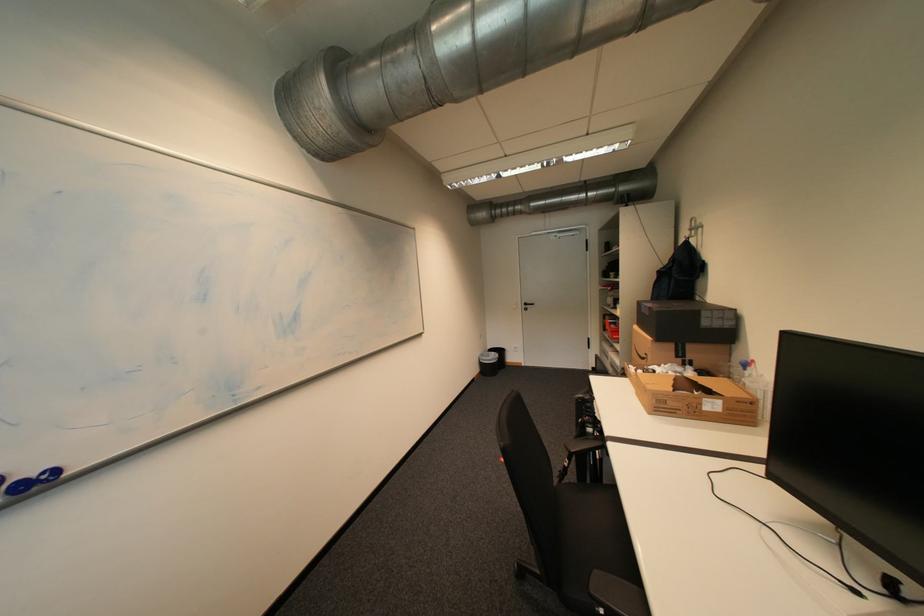
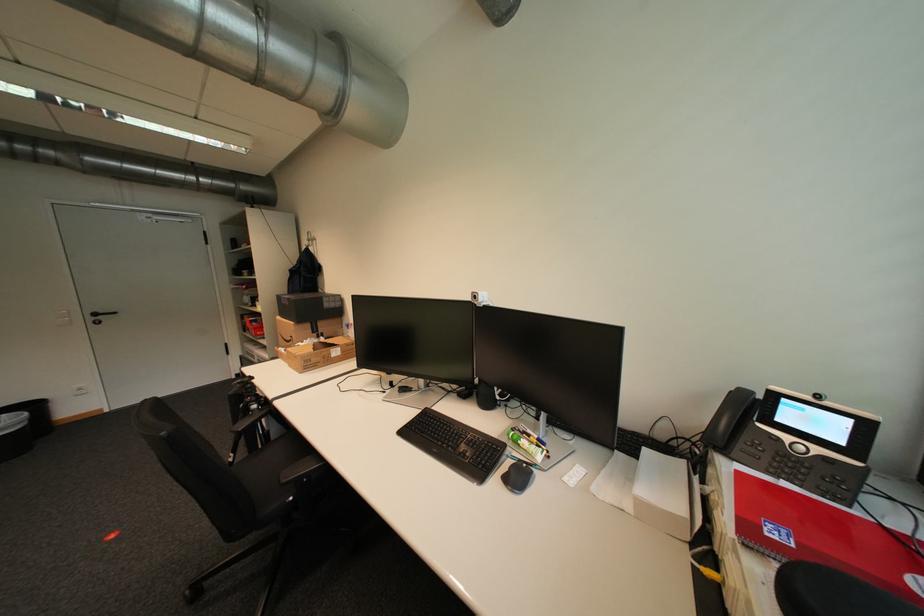
The point at (533, 305) is marked in the first image. Where is the corresponding point in the second image?

(103, 315)